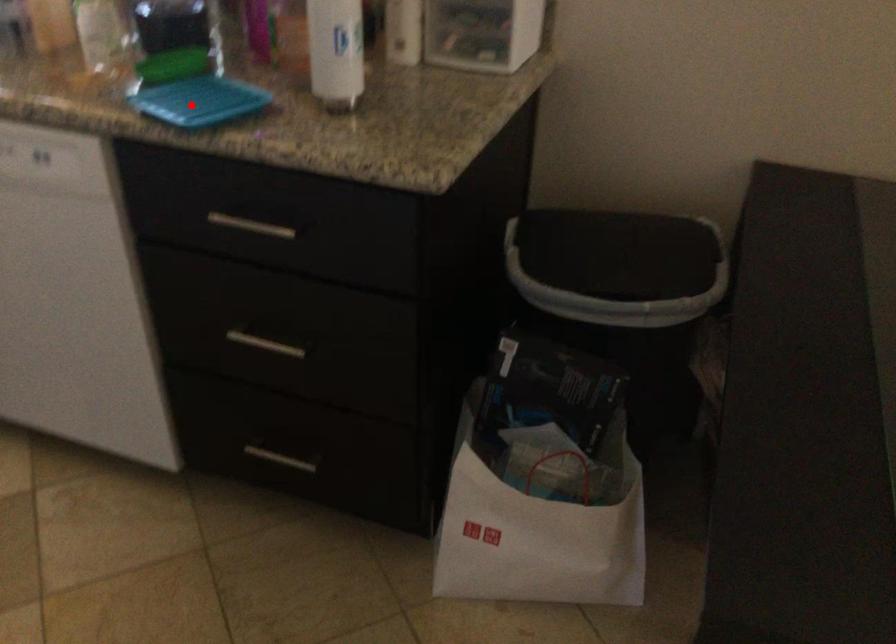
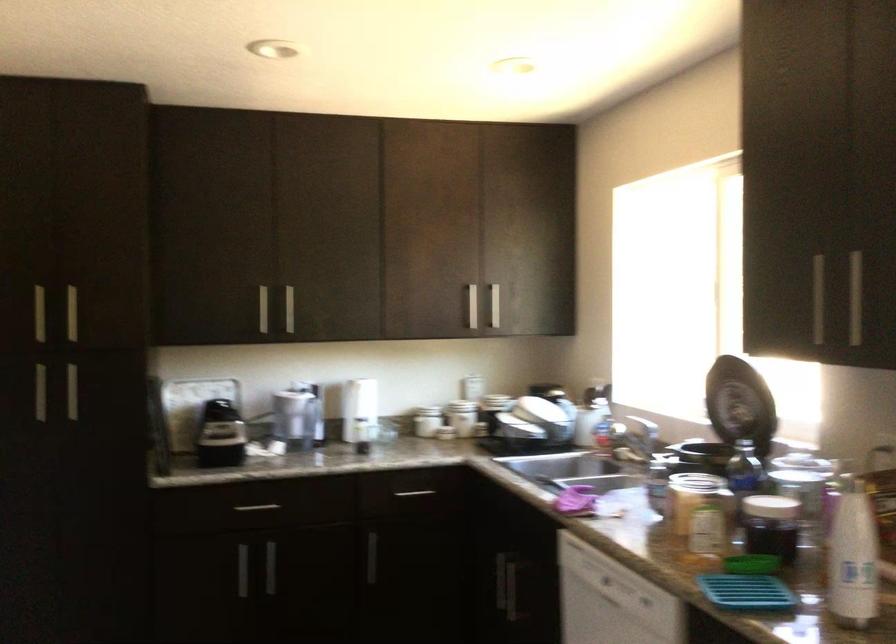
Question: I am providing you with two images of the same scene from different viewpoints. In image1, a red point is highlighted. Considering the same 3D point in image2, which of the following is correct?

Choices:
 (A) It is closer
 (B) It is farther

Answer: (B)